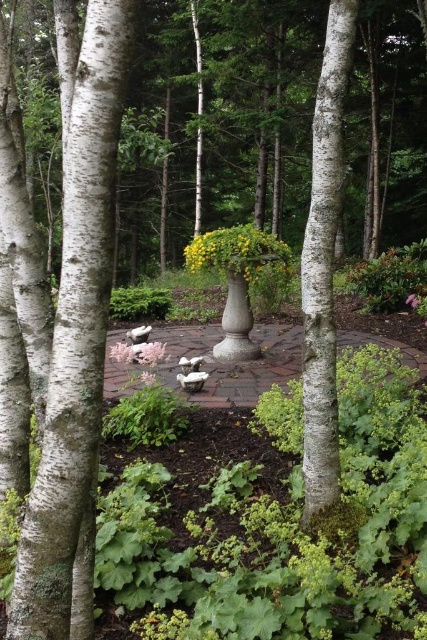
Based on the photo, you are a gardener who wants to plant a new flower between the white matte flower at center and the pink matte flower at center. Which side should you place it on to keep them aligned?

The white matte flower at center is positioned on the left side of the pink matte flower at center, so you should place the new flower between them on the right side of the white matte flower at center and the left side of the pink matte flower at center to maintain alignment.

Looking at this image, you are standing in the garden and want to take a photo of both point (131,348) and point (412,300). Which point will appear larger in your camera view?

Point (131,348) is closer to the camera than point (412,300), so it will appear larger in the photo.

You are a gardener who wants to plant a new flower in the garden. You have two options from the image, the white matte flower at center and the pink matte flower at center. Which flower should you choose if you want a taller plant?

The pink matte flower at center is taller than the white matte flower at center, so you should choose the pink matte flower at center for a taller plant.